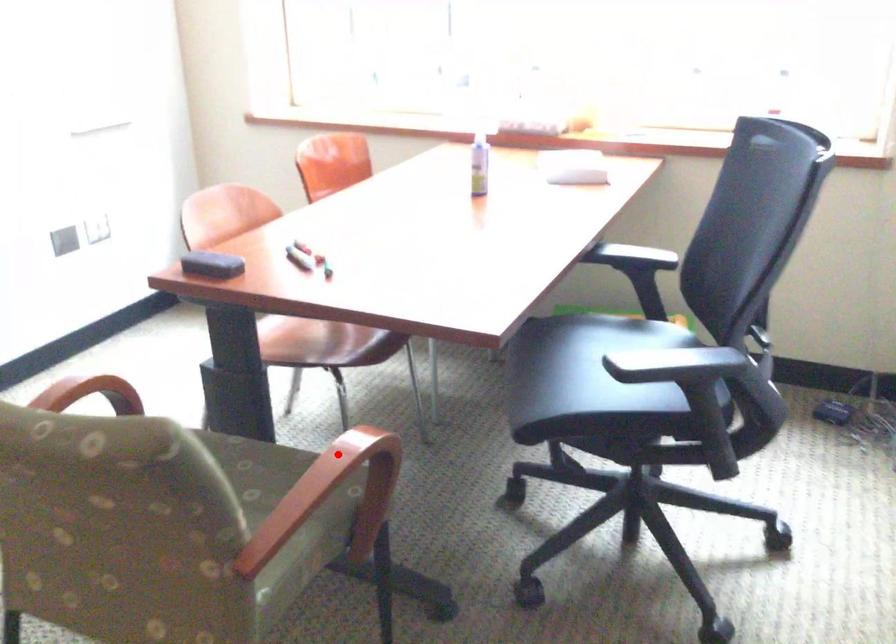
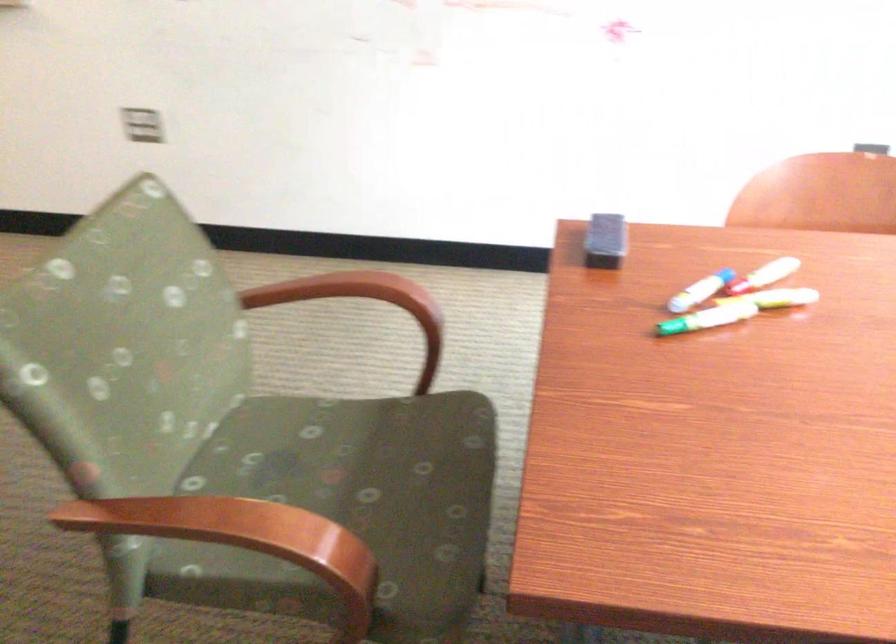
Locate, in the second image, the point that corresponds to the highlighted location in the first image.

(234, 527)